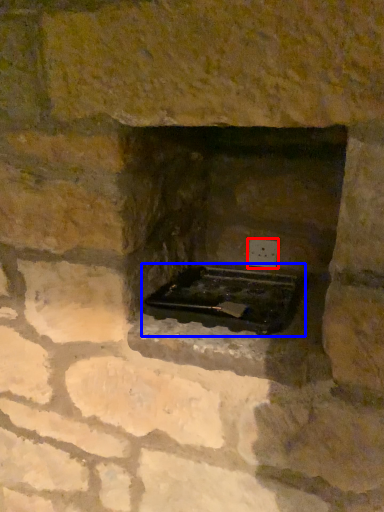
Question: Which object appears closest to the camera in this image, electric outlet (highlighted by a red box) or appliance (highlighted by a blue box)?

Choices:
 (A) electric outlet
 (B) appliance

Answer: (B)